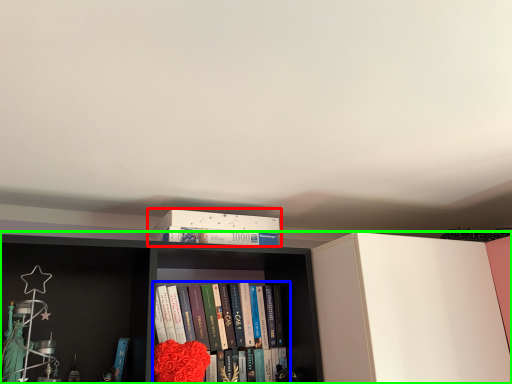
Question: Based on their relative distances, which object is farther from book cover (highlighted by a red box)? Choose from book (highlighted by a blue box) and bookcase (highlighted by a green box).

Choices:
 (A) book
 (B) bookcase

Answer: (A)